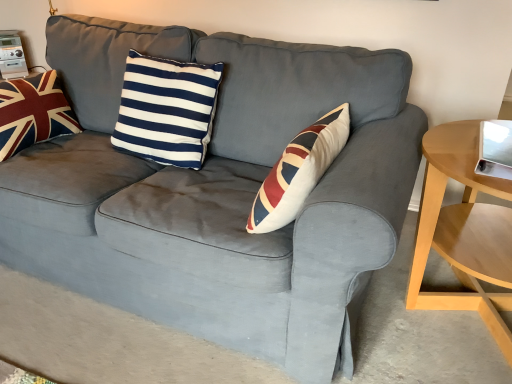
Describe the element at coordinates (33, 113) in the screenshot. Image resolution: width=512 pixels, height=384 pixels. I see `velvet union jack pillow at left, which ranks as the second pillow in right-to-left order` at that location.

This screenshot has height=384, width=512. What do you see at coordinates (167, 110) in the screenshot?
I see `navy/white striped cushion at center, which ranks as the second pillow in left-to-right order` at bounding box center [167, 110].

The height and width of the screenshot is (384, 512). Identify the location of light wood/woodenobject at right. (464, 231).

Considering the relative sizes of navy/white striped cushion at center, which ranks as the second pillow in left-to-right order, and velvet union jack pillow at left, placed as the 1th pillow when sorted from left to right, in the image provided, is navy/white striped cushion at center, which ranks as the second pillow in left-to-right order, smaller than velvet union jack pillow at left, placed as the 1th pillow when sorted from left to right,?

Incorrect, navy/white striped cushion at center, which ranks as the second pillow in left-to-right order, is not smaller in size than velvet union jack pillow at left, placed as the 1th pillow when sorted from left to right.

How many degrees apart are the facing directions of navy/white striped cushion at center, which ranks as the second pillow in left-to-right order, and velvet union jack pillow at left, which ranks as the second pillow in right-to-left order?

The facing directions of navy/white striped cushion at center, which ranks as the second pillow in left-to-right order, and velvet union jack pillow at left, which ranks as the second pillow in right-to-left order, are 89.9 degrees apart.

In the scene shown: Is navy/white striped cushion at center, the 1th pillow positioned from the right, looking in the opposite direction of velvet union jack pillow at left, placed as the 1th pillow when sorted from left to right?

No, navy/white striped cushion at center, the 1th pillow positioned from the right,'s orientation is not away from velvet union jack pillow at left, placed as the 1th pillow when sorted from left to right.

From the image's perspective, is navy/white striped cushion at center, the 1th pillow positioned from the right, above velvet union jack pillow at left, which ranks as the second pillow in right-to-left order?

No, from the image's perspective, navy/white striped cushion at center, the 1th pillow positioned from the right, is not on top of velvet union jack pillow at left, which ranks as the second pillow in right-to-left order.

Is light wood/woodenobject at right not near navy/white striped cushion at center, the 1th pillow positioned from the right?

No, light wood/woodenobject at right is not far away from navy/white striped cushion at center, the 1th pillow positioned from the right.

Who is more distant, light wood/woodenobject at right or navy/white striped cushion at center, the 1th pillow positioned from the right?

navy/white striped cushion at center, the 1th pillow positioned from the right, is more distant.

Do you think light wood/woodenobject at right is within navy/white striped cushion at center, which ranks as the second pillow in left-to-right order, or outside of it?

light wood/woodenobject at right is not enclosed by navy/white striped cushion at center, which ranks as the second pillow in left-to-right order.

Considering the sizes of objects light wood/woodenobject at right and velvet union jack pillow at left, which ranks as the second pillow in right-to-left order, in the image provided, who is shorter, light wood/woodenobject at right or velvet union jack pillow at left, which ranks as the second pillow in right-to-left order,?

Standing shorter between the two is velvet union jack pillow at left, which ranks as the second pillow in right-to-left order.

Consider the image. From the image's perspective, is light wood/woodenobject at right above or below velvet union jack pillow at left, placed as the 1th pillow when sorted from left to right?

From the image's perspective, light wood/woodenobject at right appears below velvet union jack pillow at left, placed as the 1th pillow when sorted from left to right.

Is light wood/woodenobject at right oriented towards velvet union jack pillow at left, placed as the 1th pillow when sorted from left to right?

No, light wood/woodenobject at right is not turned towards velvet union jack pillow at left, placed as the 1th pillow when sorted from left to right.

Identify the location of the 1st pillow positioned above the light wood/woodenobject at right (from a real-world perspective). The image size is (512, 384). (33, 113).

In order to click on the 1st pillow positioned above the light wood/woodenobject at right (from the image's perspective) in this screenshot , I will do `click(167, 110)`.

Which of these two, navy/white striped cushion at center, which ranks as the second pillow in left-to-right order, or light wood/woodenobject at right, is smaller?

With smaller size is navy/white striped cushion at center, which ranks as the second pillow in left-to-right order.

Is navy/white striped cushion at center, which ranks as the second pillow in left-to-right order, not within light wood/woodenobject at right?

navy/white striped cushion at center, which ranks as the second pillow in left-to-right order, lies outside light wood/woodenobject at right's area.

From the image's perspective, is navy/white striped cushion at center, which ranks as the second pillow in left-to-right order, under light wood/woodenobject at right?

No, from the image's perspective, navy/white striped cushion at center, which ranks as the second pillow in left-to-right order, is not beneath light wood/woodenobject at right.

Considering the positions of objects velvet union jack pillow at left, which ranks as the second pillow in right-to-left order, and navy/white striped cushion at center, the 1th pillow positioned from the right, in the image provided, who is in front, velvet union jack pillow at left, which ranks as the second pillow in right-to-left order, or navy/white striped cushion at center, the 1th pillow positioned from the right,?

Positioned in front is navy/white striped cushion at center, the 1th pillow positioned from the right.

Considering the sizes of objects velvet union jack pillow at left, placed as the 1th pillow when sorted from left to right, and navy/white striped cushion at center, the 1th pillow positioned from the right, in the image provided, who is taller, velvet union jack pillow at left, placed as the 1th pillow when sorted from left to right, or navy/white striped cushion at center, the 1th pillow positioned from the right,?

navy/white striped cushion at center, the 1th pillow positioned from the right, is taller.

Is velvet union jack pillow at left, placed as the 1th pillow when sorted from left to right, positioned far away from navy/white striped cushion at center, the 1th pillow positioned from the right?

No.

Looking at this image, considering the relative positions of velvet union jack pillow at left, which ranks as the second pillow in right-to-left order, and navy/white striped cushion at center, the 1th pillow positioned from the right, in the image provided, is velvet union jack pillow at left, which ranks as the second pillow in right-to-left order, to the left or to the right of navy/white striped cushion at center, the 1th pillow positioned from the right,?

In the image, velvet union jack pillow at left, which ranks as the second pillow in right-to-left order, appears on the left side of navy/white striped cushion at center, the 1th pillow positioned from the right.

Is point (6, 158) positioned in front of point (487, 251)?

No, it is behind (487, 251).

Considering the sizes of objects velvet union jack pillow at left, which ranks as the second pillow in right-to-left order, and light wood/woodenobject at right in the image provided, who is thinner, velvet union jack pillow at left, which ranks as the second pillow in right-to-left order, or light wood/woodenobject at right?

With smaller width is velvet union jack pillow at left, which ranks as the second pillow in right-to-left order.

The image size is (512, 384). I want to click on pillow that is the 2nd one when counting leftward from the light wood/woodenobject at right, so click(x=33, y=113).

Considering the relative sizes of velvet union jack pillow at left, which ranks as the second pillow in right-to-left order, and light wood/woodenobject at right in the image provided, is velvet union jack pillow at left, which ranks as the second pillow in right-to-left order, smaller than light wood/woodenobject at right?

Yes.

You are a GUI agent. You are given a task and a screenshot of the screen. Output one action in this format:
    pyautogui.click(x=<x>, y=<y>)
    Task: Click on the pillow that appears above the velvet union jack pillow at left, placed as the 1th pillow when sorted from left to right (from a real-world perspective)
    
    Given the screenshot: What is the action you would take?
    pyautogui.click(x=167, y=110)

Find the location of a particular element. The height and width of the screenshot is (384, 512). pillow that is the 1st object located behind the light wood/woodenobject at right is located at coordinates (167, 110).

Considering their positions, is light wood/woodenobject at right positioned further to velvet union jack pillow at left, placed as the 1th pillow when sorted from left to right, than navy/white striped cushion at center, the 1th pillow positioned from the right?

The object further to velvet union jack pillow at left, placed as the 1th pillow when sorted from left to right, is light wood/woodenobject at right.

Looking at the image, which one is located further to light wood/woodenobject at right, velvet union jack pillow at left, which ranks as the second pillow in right-to-left order, or navy/white striped cushion at center, the 1th pillow positioned from the right?

velvet union jack pillow at left, which ranks as the second pillow in right-to-left order, is positioned further to the anchor light wood/woodenobject at right.

Based on their spatial positions, is light wood/woodenobject at right or velvet union jack pillow at left, which ranks as the second pillow in right-to-left order, further from navy/white striped cushion at center, which ranks as the second pillow in left-to-right order?

light wood/woodenobject at right is further to navy/white striped cushion at center, which ranks as the second pillow in left-to-right order.

Looking at the image, which one is located closer to navy/white striped cushion at center, the 1th pillow positioned from the right, velvet union jack pillow at left, which ranks as the second pillow in right-to-left order, or light wood/woodenobject at right?

The object closer to navy/white striped cushion at center, the 1th pillow positioned from the right, is velvet union jack pillow at left, which ranks as the second pillow in right-to-left order.

Consider the image. Estimate the real-world distances between objects in this image. Which object is further from light wood/woodenobject at right, navy/white striped cushion at center, which ranks as the second pillow in left-to-right order, or velvet union jack pillow at left, which ranks as the second pillow in right-to-left order?

velvet union jack pillow at left, which ranks as the second pillow in right-to-left order, is further to light wood/woodenobject at right.

From the image, which object appears to be farther from velvet union jack pillow at left, placed as the 1th pillow when sorted from left to right, navy/white striped cushion at center, which ranks as the second pillow in left-to-right order, or light wood/woodenobject at right?

Based on the image, light wood/woodenobject at right appears to be further to velvet union jack pillow at left, placed as the 1th pillow when sorted from left to right.

You are a GUI agent. You are given a task and a screenshot of the screen. Output one action in this format:
    pyautogui.click(x=<x>, y=<y>)
    Task: Click on the pillow between velvet union jack pillow at left, which ranks as the second pillow in right-to-left order, and light wood/woodenobject at right
    This screenshot has width=512, height=384.
    Given the screenshot: What is the action you would take?
    pyautogui.click(x=167, y=110)